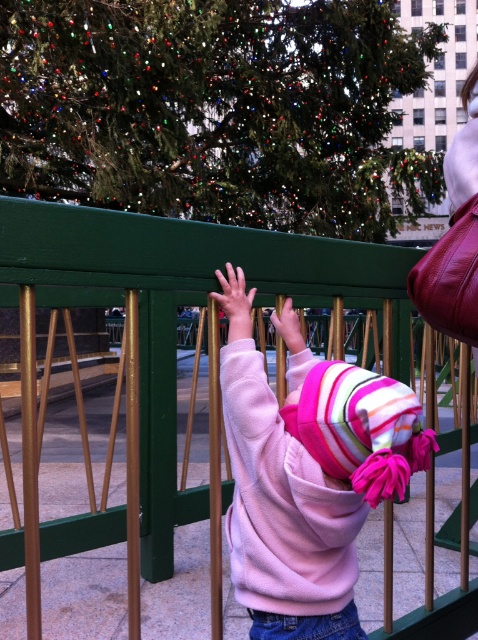
Is point (106, 288) farther from viewer compared to point (344, 458)?

No, (106, 288) is closer to viewer.

Based on the photo, is green painted metal fence at upper center below pink fleece sweatshirt at center?

Incorrect, green painted metal fence at upper center is not positioned below pink fleece sweatshirt at center.

What are the coordinates of `green painted metal fence at upper center` in the screenshot? It's located at (164, 358).

Who is higher up, green textured christmas tree at upper center or pink fleece sweatshirt at center?

green textured christmas tree at upper center

Is point (36, 186) closer to viewer compared to point (401, 426)?

No, it is behind (401, 426).

Is point (199, 60) farther from camera compared to point (291, 392)?

Yes, point (199, 60) is behind point (291, 392).

Identify the location of green textured christmas tree at upper center. This screenshot has height=640, width=478. (216, 109).

Is green textured christmas tree at upper center further to the viewer compared to green painted metal fence at upper center?

Yes, it is.

Between point (158, 177) and point (121, 522), which one is positioned in front?

Point (121, 522) is more forward.

Which is in front, point (21, 164) or point (32, 419)?

Point (32, 419)

You are a GUI agent. You are given a task and a screenshot of the screen. Output one action in this format:
    pyautogui.click(x=<x>, y=<y>)
    Task: Click on the green textured christmas tree at upper center
    The image size is (478, 640).
    Given the screenshot: What is the action you would take?
    pyautogui.click(x=216, y=109)